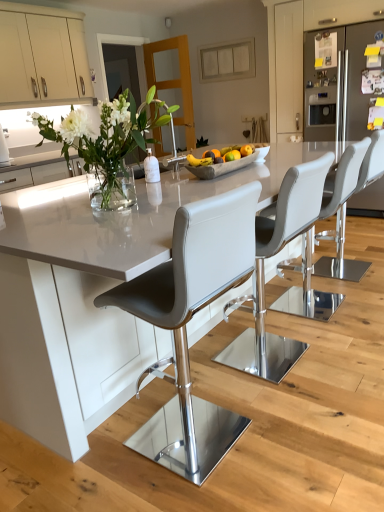
Question: Does satin white cabinet at right, the 1th cabinetry viewed from the right, come in front of matte gray bar stool at center, positioned as the fourth chair in back-to-front order?

Choices:
 (A) no
 (B) yes

Answer: (A)

Question: Can you confirm if satin white cabinet at right, the 2th cabinetry in the left-to-right sequence, is positioned to the left of matte gray bar stool at center, positioned as the fourth chair in back-to-front order?

Choices:
 (A) yes
 (B) no

Answer: (B)

Question: From a real-world perspective, is satin white cabinet at right, the 2th cabinetry in the left-to-right sequence, positioned under matte gray bar stool at center, positioned as the fourth chair in back-to-front order, based on gravity?

Choices:
 (A) yes
 (B) no

Answer: (B)

Question: Considering the relative sizes of satin white cabinet at right, the 2th cabinetry in the left-to-right sequence, and matte gray bar stool at center, positioned as the fourth chair in back-to-front order, in the image provided, is satin white cabinet at right, the 2th cabinetry in the left-to-right sequence, thinner than matte gray bar stool at center, positioned as the fourth chair in back-to-front order,?

Choices:
 (A) yes
 (B) no

Answer: (B)

Question: Can you confirm if satin white cabinet at right, the 2th cabinetry in the left-to-right sequence, is smaller than matte gray bar stool at center, acting as the first chair starting from the front?

Choices:
 (A) no
 (B) yes

Answer: (A)

Question: Is satin white cabinet at right, the 1th cabinetry viewed from the right, positioned with its back to matte gray bar stool at center, acting as the first chair starting from the front?

Choices:
 (A) no
 (B) yes

Answer: (A)

Question: Would you say yellow matte banana at center is part of white glossy table at center's contents?

Choices:
 (A) yes
 (B) no

Answer: (B)

Question: Is white glossy table at center at the left side of yellow matte banana at center?

Choices:
 (A) yes
 (B) no

Answer: (B)

Question: Is white glossy table at center closer to camera compared to yellow matte banana at center?

Choices:
 (A) yes
 (B) no

Answer: (A)

Question: From the image's perspective, is white glossy table at center under yellow matte banana at center?

Choices:
 (A) no
 (B) yes

Answer: (B)

Question: Can you confirm if white glossy table at center is positioned to the right of yellow matte banana at center?

Choices:
 (A) no
 (B) yes

Answer: (B)

Question: Is white glossy table at center smaller than yellow matte banana at center?

Choices:
 (A) no
 (B) yes

Answer: (A)

Question: Can you confirm if matte gray bar stool at center, which ranks as the fourth chair in front-to-back order, is wider than white leather bar stool at center, which is the second chair in front-to-back order?

Choices:
 (A) no
 (B) yes

Answer: (A)